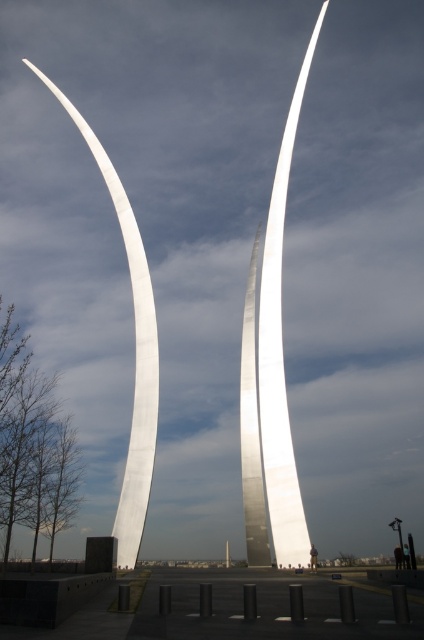
You are standing at the entrance of the sculpture garden and see the point marked at coordinates [273,368]. What does this point indicate?

The point marked at coordinates [273,368] indicates the location of the polished metal sculpture at center.

You are an architect visiting the sculpture garden. You notice the polished metal sculpture at center and the polished silver sculpture at left. Which sculpture would cast a longer shadow at noon when the sun is directly overhead?

The polished metal sculpture at center is taller than the polished silver sculpture at left, so it would cast a longer shadow at noon when the sun is directly overhead because taller objects typically cast longer shadows under the same lighting conditions.

You are a visitor standing at the entrance of the sculpture garden. You see the polished metal sculpture at center and the polished silver sculpture at left. Which sculpture is closer to you?

The polished metal sculpture at center is closer to you because it is in front of the polished silver sculpture at left.